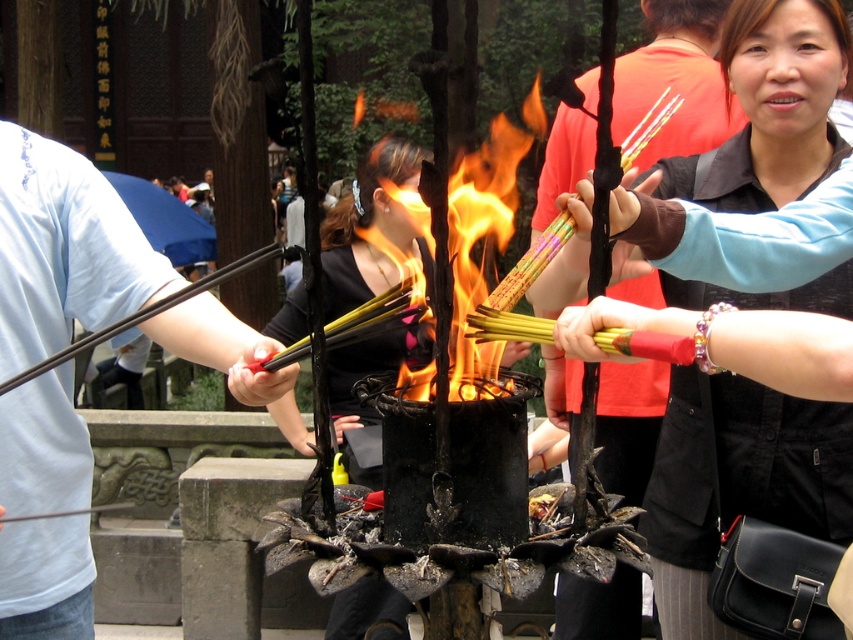
Question: Can you confirm if matte black incense sticks at center is wider than flameflame" at "center?

Choices:
 (A) no
 (B) yes

Answer: (A)

Question: Which point is farther from the camera taking this photo?

Choices:
 (A) (474, 285)
 (B) (821, 532)

Answer: (B)

Question: Does matte black incense sticks at center appear over flameflame" at "center?

Choices:
 (A) yes
 (B) no

Answer: (B)

Question: Which point is closer to the camera taking this photo?

Choices:
 (A) (804, 36)
 (B) (473, 200)

Answer: (B)

Question: Does matte black incense sticks at center appear under flameflame" at "center?

Choices:
 (A) no
 (B) yes

Answer: (B)